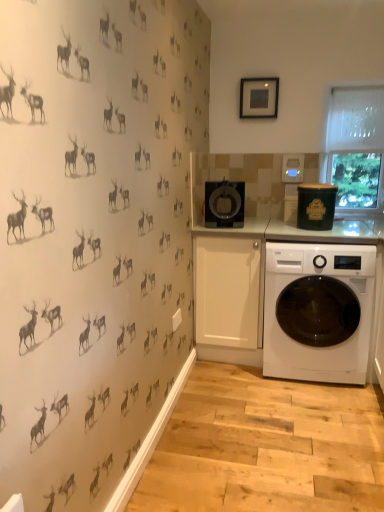
Locate an element on the screen. Image resolution: width=384 pixels, height=512 pixels. free region under black glossy coffee maker at center, the 1th appliance positioned from the left (from a real-world perspective) is located at coordinates (223, 227).